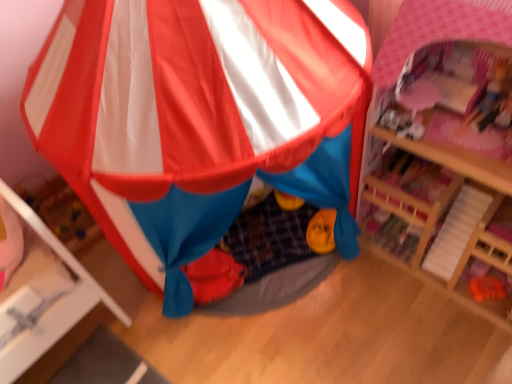
This screenshot has height=384, width=512. Find the location of `matte plastic tent at center`. matte plastic tent at center is located at coordinates pos(200,121).

Describe the element at coordinates (200, 121) in the screenshot. I see `matte plastic tent at center` at that location.

Describe the element at coordinates (442, 234) in the screenshot. This screenshot has width=512, height=384. I see `pink wood dollhouse at upper right` at that location.

This screenshot has width=512, height=384. Find the location of `pink wood dollhouse at upper right`. pink wood dollhouse at upper right is located at coordinates (442, 234).

The image size is (512, 384). Find the location of `matte plastic tent at center`. matte plastic tent at center is located at coordinates (200, 121).

Does pink wood dollhouse at upper right appear on the right side of matte plastic tent at center?

Correct, you'll find pink wood dollhouse at upper right to the right of matte plastic tent at center.

Consider the image. In the image, is pink wood dollhouse at upper right positioned in front of or behind matte plastic tent at center?

pink wood dollhouse at upper right is positioned farther from the viewer than matte plastic tent at center.

Is point (458, 216) positioned before point (85, 105)?

No, it is not.

From the image's perspective, between pink wood dollhouse at upper right and matte plastic tent at center, who is located below?

pink wood dollhouse at upper right, from the image's perspective.

From a real-world perspective, which is physically above, pink wood dollhouse at upper right or matte plastic tent at center?

matte plastic tent at center, from a real-world perspective.

Considering the sizes of pink wood dollhouse at upper right and matte plastic tent at center in the image, is pink wood dollhouse at upper right wider or thinner than matte plastic tent at center?

Considering their sizes, pink wood dollhouse at upper right looks slimmer than matte plastic tent at center.

Who is shorter, pink wood dollhouse at upper right or matte plastic tent at center?

With less height is pink wood dollhouse at upper right.

Between pink wood dollhouse at upper right and matte plastic tent at center, which one has smaller size?

pink wood dollhouse at upper right is smaller.

Is pink wood dollhouse at upper right inside the boundaries of matte plastic tent at center, or outside?

pink wood dollhouse at upper right exists outside the volume of matte plastic tent at center.

Is pink wood dollhouse at upper right beside matte plastic tent at center?

pink wood dollhouse at upper right and matte plastic tent at center are not in contact.

Is pink wood dollhouse at upper right positioned with its back to matte plastic tent at center?

pink wood dollhouse at upper right does not have its back to matte plastic tent at center.

Looking at this image, can you tell me how much pink wood dollhouse at upper right and matte plastic tent at center differ in facing direction?

They differ by 49.4 degrees in their facing directions.

Locate an element on the screen. The width and height of the screenshot is (512, 384). table behind the matte plastic tent at center is located at coordinates (442, 234).

Is matte plastic tent at center to the left or to the right of pink wood dollhouse at upper right in the image?

matte plastic tent at center is positioned on pink wood dollhouse at upper right's left side.

Which object is closer to the camera taking this photo, matte plastic tent at center or pink wood dollhouse at upper right?

matte plastic tent at center is closer to the camera.

Which is more distant, (137, 175) or (466, 266)?

The point (466, 266) is farther from the camera.

From the image's perspective, which one is positioned higher, matte plastic tent at center or pink wood dollhouse at upper right?

matte plastic tent at center appears higher in the image.

From a real-world perspective, is matte plastic tent at center above or below pink wood dollhouse at upper right?

matte plastic tent at center is above pink wood dollhouse at upper right.

Which of these two, matte plastic tent at center or pink wood dollhouse at upper right, is thinner?

pink wood dollhouse at upper right.

Consider the image. Which of these two, matte plastic tent at center or pink wood dollhouse at upper right, stands taller?

Standing taller between the two is matte plastic tent at center.

Considering the relative sizes of matte plastic tent at center and pink wood dollhouse at upper right in the image provided, is matte plastic tent at center bigger than pink wood dollhouse at upper right?

Correct, matte plastic tent at center is larger in size than pink wood dollhouse at upper right.

Is pink wood dollhouse at upper right surrounded by matte plastic tent at center?

No, matte plastic tent at center does not contain pink wood dollhouse at upper right.

Does matte plastic tent at center touch pink wood dollhouse at upper right?

No, matte plastic tent at center is not with pink wood dollhouse at upper right.

Is matte plastic tent at center positioned with its back to pink wood dollhouse at upper right?

No.

How distant is matte plastic tent at center from pink wood dollhouse at upper right?

matte plastic tent at center is 16.79 inches away from pink wood dollhouse at upper right.

Where is `tent that is above the pink wood dollhouse at upper right (from the image's perspective)`? The height and width of the screenshot is (384, 512). tent that is above the pink wood dollhouse at upper right (from the image's perspective) is located at coordinates (200, 121).

Find the location of a particular element. The height and width of the screenshot is (384, 512). table below the matte plastic tent at center (from the image's perspective) is located at coordinates (442, 234).

There is a pink wood dollhouse at upper right. Identify the location of tent above it (from a real-world perspective). (200, 121).